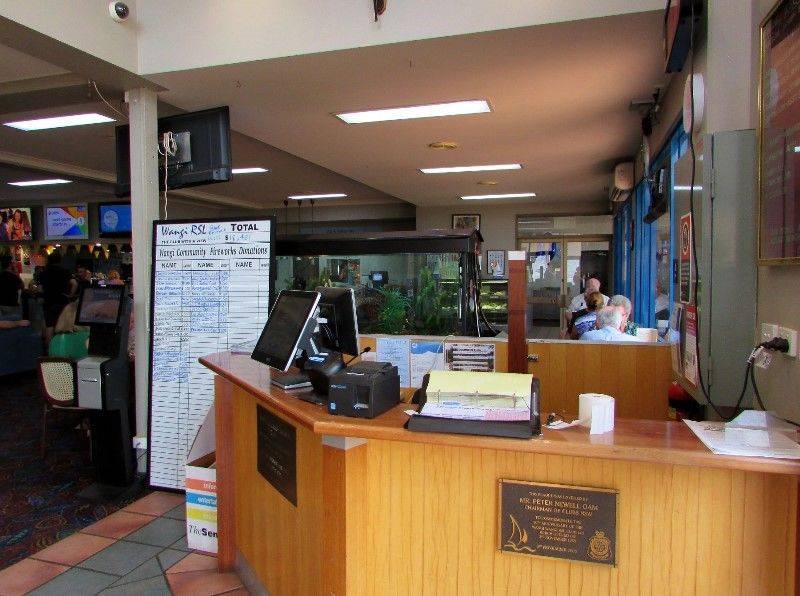
Find the location of a particular element. This screenshot has height=596, width=800. electric outlets is located at coordinates (790, 338).